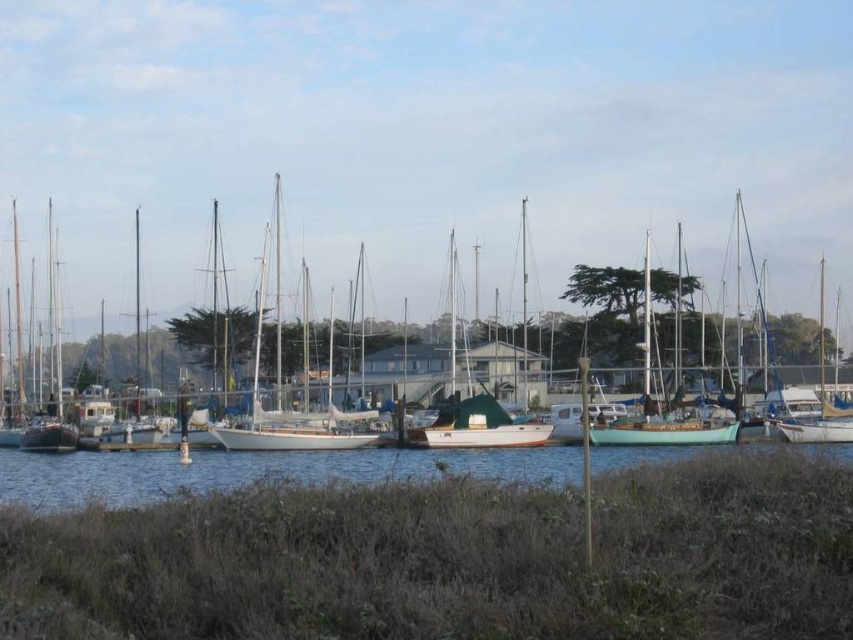
Question: Can you confirm if smooth white boat at center is positioned to the left of blue water at lower center?

Choices:
 (A) yes
 (B) no

Answer: (B)

Question: Which object is positioned farthest from the white matte sailboat at center?

Choices:
 (A) smooth white boat at center
 (B) teal matte sailboat at center

Answer: (A)

Question: Is smooth white boat at center to the right of white matte sailboat at center from the viewer's perspective?

Choices:
 (A) yes
 (B) no

Answer: (A)

Question: Does blue water at lower center have a greater width compared to white matte sailboat at center?

Choices:
 (A) yes
 (B) no

Answer: (A)

Question: Which point is farther to the camera?

Choices:
 (A) (544, 477)
 (B) (253, 445)
 (C) (608, 484)
 (D) (323, 435)

Answer: (D)

Question: Which point is farther from the camera taking this photo?

Choices:
 (A) (310, 504)
 (B) (276, 268)
 (C) (701, 424)

Answer: (B)